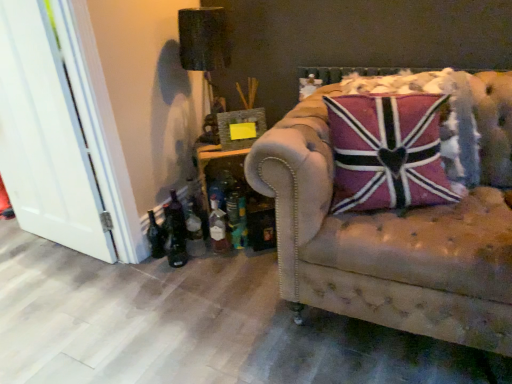
The height and width of the screenshot is (384, 512). What do you see at coordinates (238, 196) in the screenshot?
I see `wooden table at lower left` at bounding box center [238, 196].

This screenshot has width=512, height=384. Describe the element at coordinates (240, 122) in the screenshot. I see `wooden picture frame at center` at that location.

You are a GUI agent. You are given a task and a screenshot of the screen. Output one action in this format:
    pyautogui.click(x=<x>, y=<y>)
    Task: Click on the wooden picture frame at center
    
    Given the screenshot: What is the action you would take?
    pyautogui.click(x=240, y=122)

At what (x,y) coordinates should I click in order to perform the action: click on wooden table at lower left. Please return your answer as a coordinate pair (x, y). The width and height of the screenshot is (512, 384). Looking at the image, I should click on (238, 196).

Can you tell me how much leather tufted couch at right and wooden table at lower left differ in facing direction?

32.5 degrees.

Considering the positions of points (505, 209) and (204, 155), is point (505, 209) farther from camera compared to point (204, 155)?

That is False.

Which object is more forward, leather tufted couch at right or wooden table at lower left?

leather tufted couch at right is in front.

From the image's perspective, relative to wooden table at lower left, is leather tufted couch at right above or below?

leather tufted couch at right is below wooden table at lower left.

Are black textured lampshade at upper left and white wood door at left beside each other?

No, black textured lampshade at upper left is not with white wood door at left.

Is black textured lampshade at upper left turned away from white wood door at left?

That's not correct — black textured lampshade at upper left is not looking away from white wood door at left.

Is black textured lampshade at upper left situated inside white wood door at left or outside?

black textured lampshade at upper left lies outside white wood door at left.

How different are the orientations of green glass bottle at lower left and dark glass bottle at lower left, which is the 1th bottle from left to right, in degrees?

The facing directions of green glass bottle at lower left and dark glass bottle at lower left, which is the 1th bottle from left to right, are 0.936 degrees apart.

Is green glass bottle at lower left facing towards dark glass bottle at lower left, which is the 1th bottle from left to right?

No.

How much distance is there between green glass bottle at lower left and dark glass bottle at lower left, the 3th bottle when ordered from right to left?

They are 3.54 inches apart.

Can you confirm if green glass bottle at lower left is thinner than dark glass bottle at lower left, the 3th bottle when ordered from right to left?

Yes.

Is white wood door at left aimed at dark glass bottle at lower left, which is the 1th bottle from left to right?

No, white wood door at left is not turned towards dark glass bottle at lower left, which is the 1th bottle from left to right.

Considering the relative positions of white wood door at left and dark glass bottle at lower left, which is the 1th bottle from left to right, in the image provided, is white wood door at left in front of dark glass bottle at lower left, which is the 1th bottle from left to right,?

Yes.

Are white wood door at left and dark glass bottle at lower left, the 3th bottle when ordered from right to left, beside each other?

white wood door at left and dark glass bottle at lower left, the 3th bottle when ordered from right to left, are not in contact.

From the image's perspective, which one is positioned higher, white wood door at left or dark glass bottle at lower left, the 3th bottle when ordered from right to left?

white wood door at left, from the image's perspective.

Does translucent glass bottle at lower left, acting as the 3th bottle starting from the left, appear on the right side of green glass bottle at lower left?

Yes, translucent glass bottle at lower left, acting as the 3th bottle starting from the left, is to the right of green glass bottle at lower left.

Is translucent glass bottle at lower left, the 1th bottle viewed from the right, looking in the opposite direction of green glass bottle at lower left?

No, green glass bottle at lower left is not at the back of translucent glass bottle at lower left, the 1th bottle viewed from the right.

From a real-world perspective, is translucent glass bottle at lower left, the 1th bottle viewed from the right, positioned above or below green glass bottle at lower left?

translucent glass bottle at lower left, the 1th bottle viewed from the right, is above green glass bottle at lower left.

Can we say translucent glass bottle at lower left, acting as the 3th bottle starting from the left, lies outside green glass bottle at lower left?

Yes, translucent glass bottle at lower left, acting as the 3th bottle starting from the left, is not within green glass bottle at lower left.

Can we say wooden picture frame at center lies outside leather tufted couch at right?

Indeed, wooden picture frame at center is completely outside leather tufted couch at right.

Could you tell me if wooden picture frame at center is turned towards leather tufted couch at right?

Yes, wooden picture frame at center is aimed at leather tufted couch at right.

Is wooden picture frame at center further to camera compared to leather tufted couch at right?

Yes, wooden picture frame at center is further from the viewer.

From the image's perspective, relative to leather tufted couch at right, is wooden picture frame at center above or below?

Clearly, from the image's perspective, wooden picture frame at center is above leather tufted couch at right.

Which is in front, point (259, 212) or point (400, 164)?

The point (400, 164) is in front.

Considering the sizes of objects wooden table at lower left and pink fabric pillow at center in the image provided, who is thinner, wooden table at lower left or pink fabric pillow at center?

pink fabric pillow at center is thinner.

Which object is more forward, wooden table at lower left or pink fabric pillow at center?

Positioned in front is pink fabric pillow at center.

Is wooden table at lower left not within pink fabric pillow at center?

wooden table at lower left lies outside pink fabric pillow at center's area.

The height and width of the screenshot is (384, 512). I want to click on studio couch below the wooden table at lower left (from the image's perspective), so click(x=397, y=228).

The width and height of the screenshot is (512, 384). What are the coordinates of `table lamp that is on the right side of white wood door at left` in the screenshot? It's located at (203, 40).

Which object lies further to the anchor point translucent glass bottle at lower left, the 1th bottle viewed from the right, pink fabric pillow at center or translucent glass bottle at lower left, the 2th bottle in the left-to-right sequence?

pink fabric pillow at center.

When comparing their distances from pink fabric pillow at center, does translucent glass bottle at lower left, the 2th bottle in the left-to-right sequence, or translucent glass bottle at lower left, acting as the 3th bottle starting from the left, seem further?

translucent glass bottle at lower left, the 2th bottle in the left-to-right sequence, is further to pink fabric pillow at center.

Based on their spatial positions, is black textured lampshade at upper left or translucent glass bottle at lower left, the 1th bottle viewed from the right, further from pink fabric pillow at center?

Among the two, black textured lampshade at upper left is located further to pink fabric pillow at center.

When comparing their distances from translucent glass bottle at lower left, the 1th bottle viewed from the right, does green glass bottle at lower left or pink fabric pillow at center seem closer?

The object closer to translucent glass bottle at lower left, the 1th bottle viewed from the right, is green glass bottle at lower left.

Based on their spatial positions, is wooden table at lower left or translucent glass bottle at lower left, the 2th bottle in the left-to-right sequence, further from pink fabric pillow at center?

translucent glass bottle at lower left, the 2th bottle in the left-to-right sequence, is further to pink fabric pillow at center.

Considering their positions, is white wood door at left positioned closer to wooden table at lower left than translucent glass bottle at lower left, marked as the 2th bottle in a right-to-left arrangement?

Based on the image, translucent glass bottle at lower left, marked as the 2th bottle in a right-to-left arrangement, appears to be nearer to wooden table at lower left.

Looking at the image, which one is located further to black textured lampshade at upper left, wooden table at lower left or white wood door at left?

white wood door at left is positioned further to the anchor black textured lampshade at upper left.

Based on their spatial positions, is black textured lampshade at upper left or wooden table at lower left further from leather tufted couch at right?

black textured lampshade at upper left.

Locate an element on the screen. bottle between wooden table at lower left and translucent glass bottle at lower left, the 2th bottle in the left-to-right sequence, from top to bottom is located at coordinates (218, 227).

You are a GUI agent. You are given a task and a screenshot of the screen. Output one action in this format:
    pyautogui.click(x=<x>, y=<y>)
    Task: Click on the table between black textured lampshade at upper left and translucent glass bottle at lower left, acting as the 3th bottle starting from the left, in the vertical direction
    Image resolution: width=512 pixels, height=384 pixels.
    Given the screenshot: What is the action you would take?
    pyautogui.click(x=238, y=196)

Identify the location of beer bottle located between white wood door at left and translucent glass bottle at lower left, acting as the 3th bottle starting from the left, in the left-right direction. This screenshot has height=384, width=512. (176, 222).

Identify the location of table between black textured lampshade at upper left and green glass bottle at lower left from top to bottom. This screenshot has width=512, height=384. (238, 196).